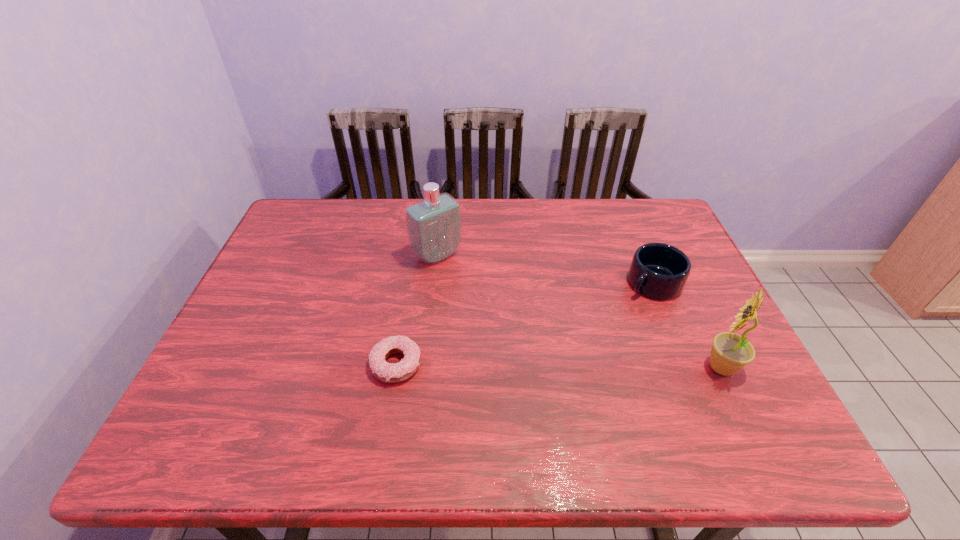
Find the location of a particular element. The image size is (960, 540). blank space at the far edge of the desktop is located at coordinates (587, 237).

The image size is (960, 540). What are the coordinates of `vacant space at the near edge of the desktop` in the screenshot? It's located at (633, 382).

The height and width of the screenshot is (540, 960). In the image, there is a desktop. Find the location of `vacant area at the left edge`. vacant area at the left edge is located at coordinates (283, 319).

Where is `vacant space at the right edge`? Image resolution: width=960 pixels, height=540 pixels. vacant space at the right edge is located at coordinates (691, 286).

What are the coordinates of `free space at the far left corner of the desktop` in the screenshot? It's located at (320, 238).

You are a GUI agent. You are given a task and a screenshot of the screen. Output one action in this format:
    pyautogui.click(x=<x>, y=<y>)
    Task: Click on the empty space that is in between the sunflower and the perfume
    The height and width of the screenshot is (540, 960).
    Given the screenshot: What is the action you would take?
    pyautogui.click(x=579, y=312)

You are a GUI agent. You are given a task and a screenshot of the screen. Output one action in this format:
    pyautogui.click(x=<x>, y=<y>)
    Task: Click on the free space between the doughnut and the sunflower
    This screenshot has height=540, width=960.
    Given the screenshot: What is the action you would take?
    pyautogui.click(x=559, y=366)

Identify the location of empty location between the mug and the perfume. (545, 269).

I want to click on vacant space that's between the perfume and the sunflower, so click(579, 312).

The height and width of the screenshot is (540, 960). I want to click on free space between the third tallest object and the sunflower, so click(x=687, y=325).